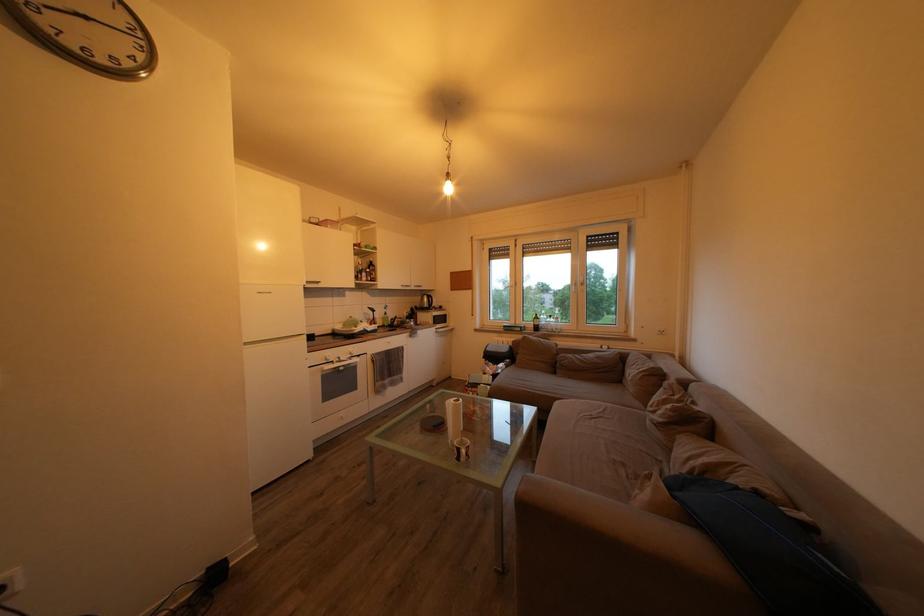
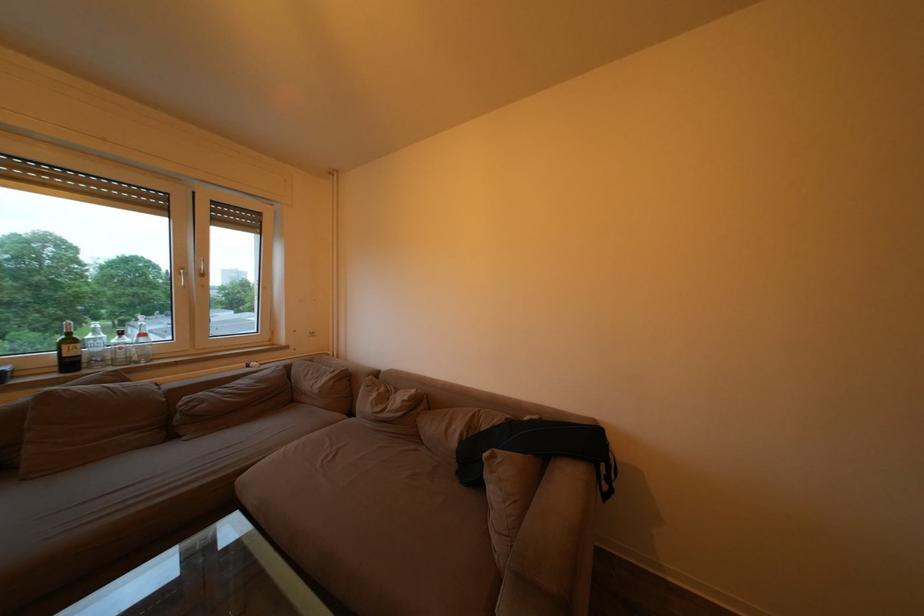
Find the pixel in the second image that matches [565,325] in the first image.

(151, 341)